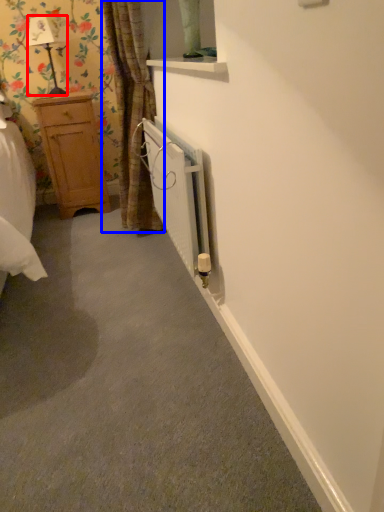
Question: Which object is closer to the camera taking this photo, lamp (highlighted by a red box) or curtain (highlighted by a blue box)?

Choices:
 (A) lamp
 (B) curtain

Answer: (B)